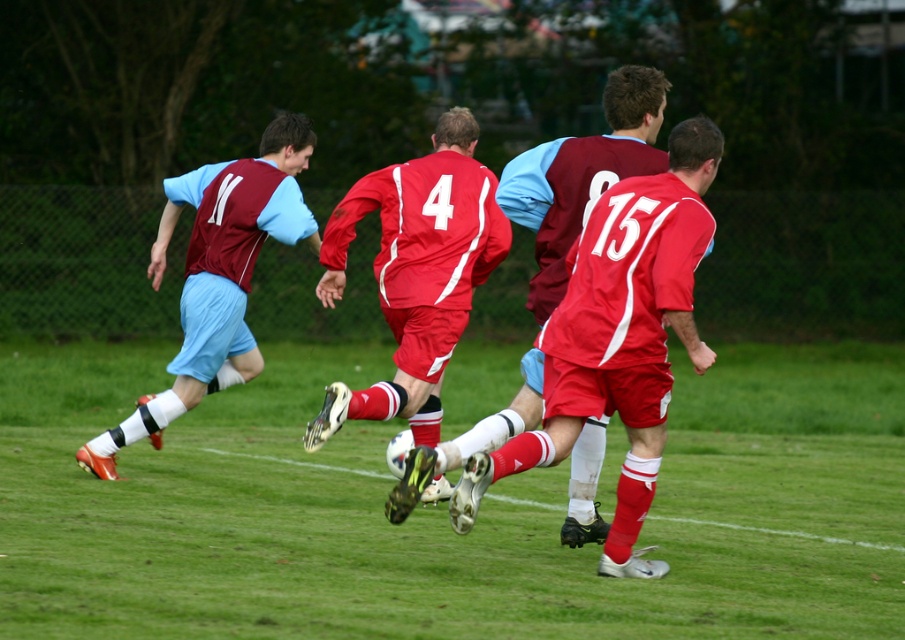
Question: Which point is closer to the camera?

Choices:
 (A) (639, 506)
 (B) (386, 468)

Answer: (A)

Question: Is matte red soccer ball at center to the left of matte maroon jersey at left from the viewer's perspective?

Choices:
 (A) yes
 (B) no

Answer: (B)

Question: In this image, where is matte red jersey at center located relative to matte maroon jersey at left?

Choices:
 (A) left
 (B) right

Answer: (B)

Question: Which object appears closest to the camera in this image?

Choices:
 (A) matte red soccer ball at center
 (B) matte red shorts at center
 (C) matte red jersey at center

Answer: (C)

Question: Is green grass at center closer to the viewer compared to matte maroon jersey at left?

Choices:
 (A) no
 (B) yes

Answer: (B)

Question: Among these points, which one is nearest to the camera?

Choices:
 (A) (687, 417)
 (B) (305, 228)
 (C) (705, 240)
 (D) (608, 308)

Answer: (C)